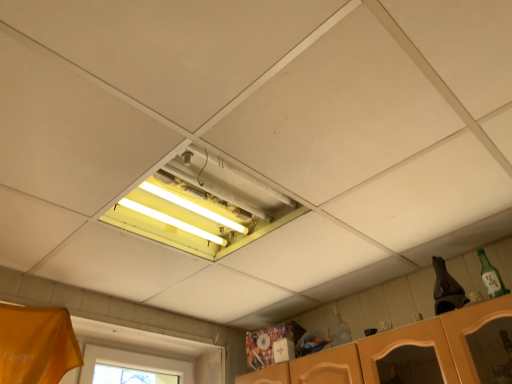
Question: From the image's perspective, would you say yellow fluorescent light at center is shown under green glass bottle at upper right?

Choices:
 (A) no
 (B) yes

Answer: (A)

Question: Does yellow fluorescent light at center turn towards green glass bottle at upper right?

Choices:
 (A) yes
 (B) no

Answer: (B)

Question: Does yellow fluorescent light at center have a lesser width compared to green glass bottle at upper right?

Choices:
 (A) no
 (B) yes

Answer: (A)

Question: From the image's perspective, is yellow fluorescent light at center on green glass bottle at upper right?

Choices:
 (A) no
 (B) yes

Answer: (B)

Question: Can you confirm if yellow fluorescent light at center is positioned to the left of green glass bottle at upper right?

Choices:
 (A) no
 (B) yes

Answer: (B)

Question: Would you say green glass bottle at upper right is part of yellow fluorescent light at center's contents?

Choices:
 (A) no
 (B) yes

Answer: (A)

Question: Does green glass bottle at upper right come behind yellow fluorescent light at center?

Choices:
 (A) no
 (B) yes

Answer: (B)

Question: Is yellow fluorescent light at center located within green glass bottle at upper right?

Choices:
 (A) no
 (B) yes

Answer: (A)

Question: Is green glass bottle at upper right to the right of yellow fluorescent light at center from the viewer's perspective?

Choices:
 (A) yes
 (B) no

Answer: (A)

Question: Does green glass bottle at upper right have a larger size compared to yellow fluorescent light at center?

Choices:
 (A) no
 (B) yes

Answer: (A)

Question: Can you confirm if green glass bottle at upper right is positioned to the left of yellow fluorescent light at center?

Choices:
 (A) no
 (B) yes

Answer: (A)

Question: From a real-world perspective, is green glass bottle at upper right over yellow fluorescent light at center?

Choices:
 (A) yes
 (B) no

Answer: (B)

Question: Is yellow fluorescent light at center wider or thinner than green glass bottle at upper right?

Choices:
 (A) wide
 (B) thin

Answer: (A)